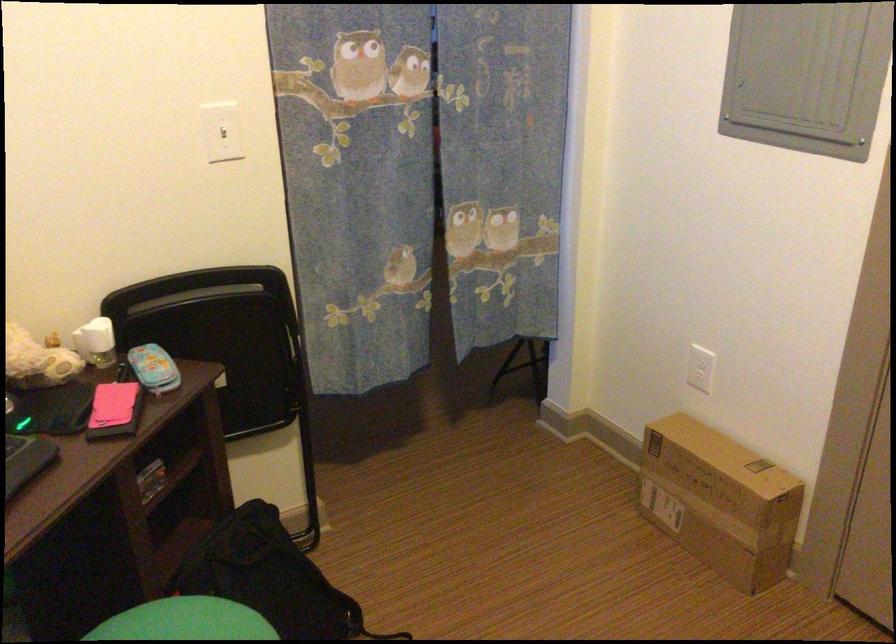
This screenshot has width=896, height=644. What do you see at coordinates (114, 410) in the screenshot? I see `the pink phone wallet` at bounding box center [114, 410].